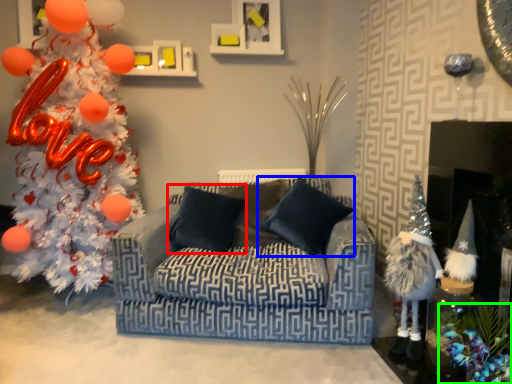
Question: Which is farther away from pillow (highlighted by a red box)? pillow (highlighted by a blue box) or christmas decoration (highlighted by a green box)?

Choices:
 (A) pillow
 (B) christmas decoration

Answer: (B)